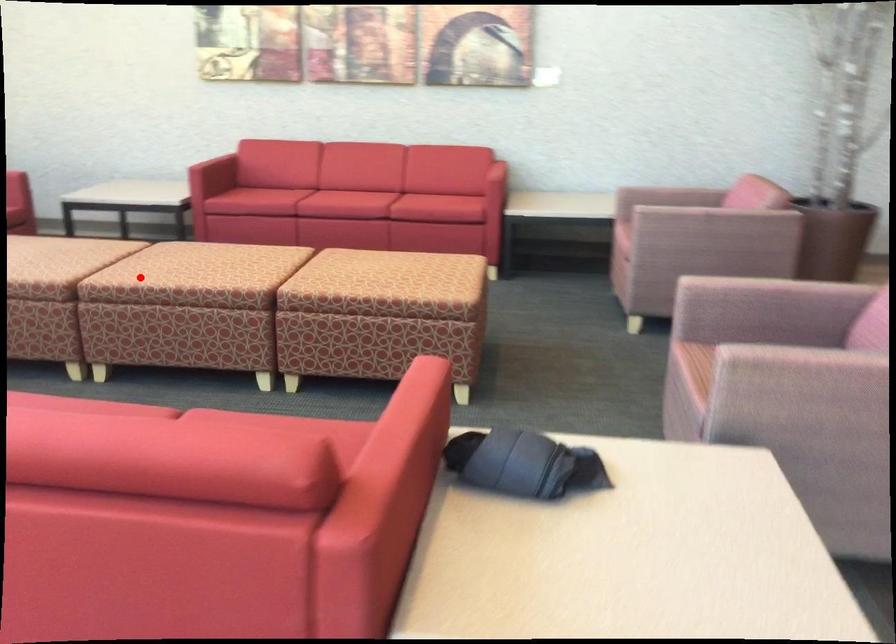
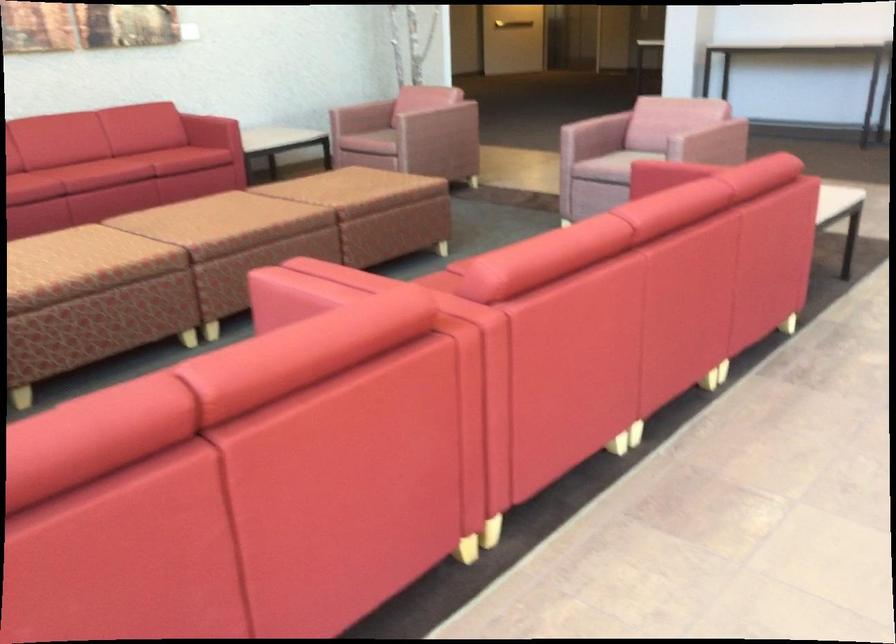
Where in the second image is the point corresponding to the highlighted location from the first image?

(254, 234)